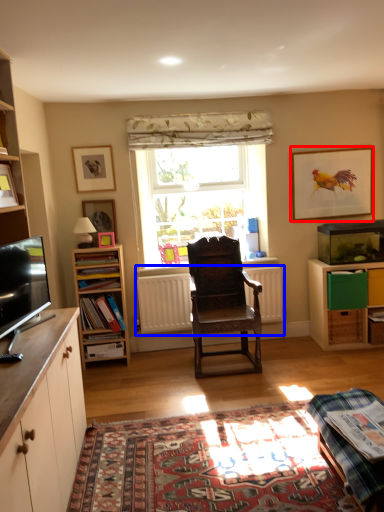
Question: Among these objects, which one is farthest to the camera, picture frame (highlighted by a red box) or radiator (highlighted by a blue box)?

Choices:
 (A) picture frame
 (B) radiator

Answer: (A)